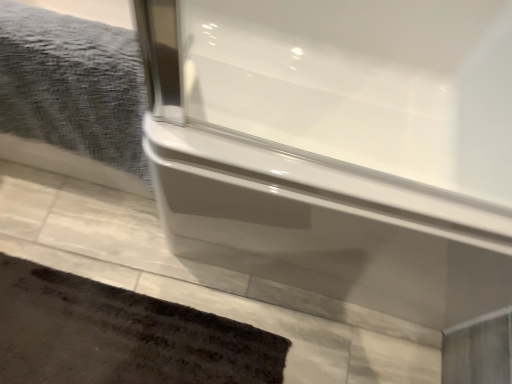
Identify the location of gray textured towel at upper left. tap(72, 97).

What do you see at coordinates (72, 97) in the screenshot?
I see `gray textured towel at upper left` at bounding box center [72, 97].

What is the approximate width of gray textured towel at upper left?

A: The width of gray textured towel at upper left is 6.54 inches.

Identify the location of dark brown textured bath mat at lower left. This screenshot has width=512, height=384. (121, 335).

The height and width of the screenshot is (384, 512). What do you see at coordinates (121, 335) in the screenshot?
I see `dark brown textured bath mat at lower left` at bounding box center [121, 335].

In order to face dark brown textured bath mat at lower left, should I rotate leftwards or rightwards?

To align with it, rotate left about 16.868°.

Find the location of a particular element. The image size is (512, 384). gray textured towel at upper left is located at coordinates (72, 97).

Based on the photo, considering the relative positions of gray textured towel at upper left and dark brown textured bath mat at lower left in the image provided, is gray textured towel at upper left to the left or to the right of dark brown textured bath mat at lower left?

gray textured towel at upper left is positioned on dark brown textured bath mat at lower left's left side.

Is gray textured towel at upper left further to camera compared to dark brown textured bath mat at lower left?

No, the depth of gray textured towel at upper left is less than that of dark brown textured bath mat at lower left.

Is point (84, 179) positioned before point (55, 296)?

No, it is behind (55, 296).

From the image's perspective, which one is positioned higher, gray textured towel at upper left or dark brown textured bath mat at lower left?

gray textured towel at upper left, from the image's perspective.

From a real-world perspective, who is located lower, gray textured towel at upper left or dark brown textured bath mat at lower left?

In real-world perspective, dark brown textured bath mat at lower left is lower.

Considering the relative sizes of gray textured towel at upper left and dark brown textured bath mat at lower left in the image provided, is gray textured towel at upper left wider than dark brown textured bath mat at lower left?

No.

Is gray textured towel at upper left taller than dark brown textured bath mat at lower left?

Correct, gray textured towel at upper left is much taller as dark brown textured bath mat at lower left.

Can you confirm if gray textured towel at upper left is smaller than dark brown textured bath mat at lower left?

No.

Is gray textured towel at upper left completely or partially outside of dark brown textured bath mat at lower left?

Absolutely, gray textured towel at upper left is external to dark brown textured bath mat at lower left.

Is gray textured towel at upper left next to dark brown textured bath mat at lower left?

No, gray textured towel at upper left is not beside dark brown textured bath mat at lower left.

Is gray textured towel at upper left positioned with its back to dark brown textured bath mat at lower left?

No, gray textured towel at upper left is not facing the opposite direction of dark brown textured bath mat at lower left.

Can you tell me how much gray textured towel at upper left and dark brown textured bath mat at lower left differ in facing direction?

88.6 degrees.

Identify the location of bath towel lying above the dark brown textured bath mat at lower left (from the image's perspective). Image resolution: width=512 pixels, height=384 pixels. (72, 97).

Does dark brown textured bath mat at lower left appear on the right side of gray textured towel at upper left?

Indeed, dark brown textured bath mat at lower left is positioned on the right side of gray textured towel at upper left.

Considering the positions of objects dark brown textured bath mat at lower left and gray textured towel at upper left in the image provided, who is in front, dark brown textured bath mat at lower left or gray textured towel at upper left?

gray textured towel at upper left is closer to the camera.

Is point (23, 352) more distant than point (80, 65)?

Yes, it is.

From the image's perspective, does dark brown textured bath mat at lower left appear lower than gray textured towel at upper left?

Yes, from the image's perspective, dark brown textured bath mat at lower left is below gray textured towel at upper left.

From a real-world perspective, is dark brown textured bath mat at lower left located higher than gray textured towel at upper left?

Answer: No, from a real-world perspective, dark brown textured bath mat at lower left is not over gray textured towel at upper left

Which of these two, dark brown textured bath mat at lower left or gray textured towel at upper left, is thinner?

Thinner between the two is gray textured towel at upper left.

Between dark brown textured bath mat at lower left and gray textured towel at upper left, which one has less height?

Standing shorter between the two is dark brown textured bath mat at lower left.

Considering the relative sizes of dark brown textured bath mat at lower left and gray textured towel at upper left in the image provided, is dark brown textured bath mat at lower left smaller than gray textured towel at upper left?

Yes, dark brown textured bath mat at lower left is smaller than gray textured towel at upper left.

Would you say dark brown textured bath mat at lower left contains gray textured towel at upper left?

No, gray textured towel at upper left is located outside of dark brown textured bath mat at lower left.

Is there a large distance between dark brown textured bath mat at lower left and gray textured towel at upper left?

That's not correct — dark brown textured bath mat at lower left is a little close to gray textured towel at upper left.

Does dark brown textured bath mat at lower left turn towards gray textured towel at upper left?

No, dark brown textured bath mat at lower left is not oriented towards gray textured towel at upper left.

Measure the distance from dark brown textured bath mat at lower left to gray textured towel at upper left.

dark brown textured bath mat at lower left and gray textured towel at upper left are 44.79 centimeters apart.

What are the coordinates of `bath mat that is below the gray textured towel at upper left (from the image's perspective)` in the screenshot? It's located at (121, 335).

This screenshot has width=512, height=384. Find the location of `bath towel on the left of dark brown textured bath mat at lower left`. bath towel on the left of dark brown textured bath mat at lower left is located at coordinates (72, 97).

Where is `bath towel above the dark brown textured bath mat at lower left (from a real-world perspective)`? Image resolution: width=512 pixels, height=384 pixels. bath towel above the dark brown textured bath mat at lower left (from a real-world perspective) is located at coordinates (72, 97).